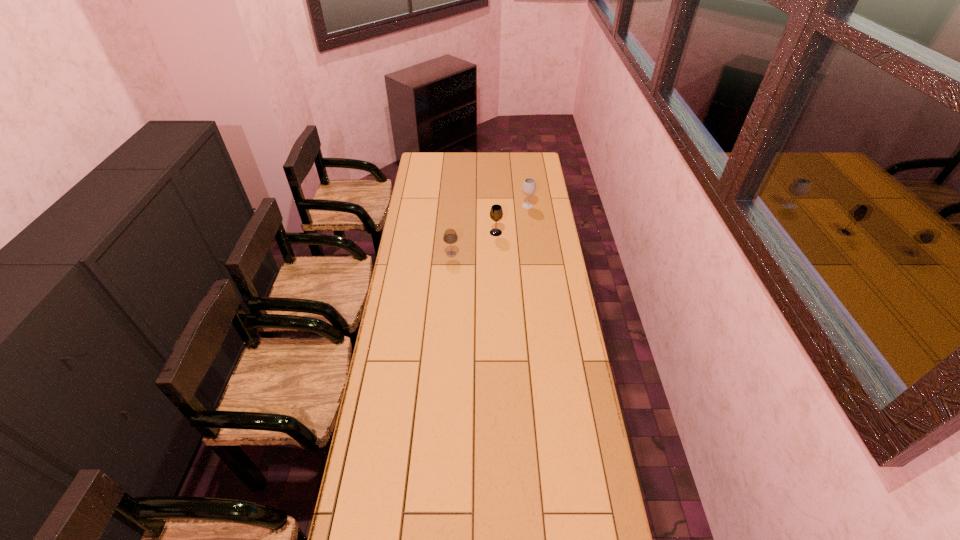
Image resolution: width=960 pixels, height=540 pixels. What are the coordinates of `vacant space at the far edge of the desktop` in the screenshot? It's located at (503, 161).

In the image, there is a desktop. Identify the location of vacant space at the left edge. (417, 179).

Identify the location of vacant space at the right edge. (558, 311).

This screenshot has height=540, width=960. What are the coordinates of `vacant space at the far left corner of the desktop` in the screenshot? It's located at tap(418, 161).

Find the location of a particular element. vacant region at the far right corner of the desktop is located at coordinates (536, 157).

At what (x,y) coordinates should I click in order to perform the action: click on vacant point located between the nearest wineglass and the second wineglass from right to left. Please return your answer as a coordinate pair (x, y). Looking at the image, I should click on (473, 243).

Identify the location of empty location between the leftmost object and the rightmost object. (490, 230).

At what (x,y) coordinates should I click in order to perform the action: click on vacant space in between the second wineglass from right to left and the nearest object. Please return your answer as a coordinate pair (x, y). The height and width of the screenshot is (540, 960). Looking at the image, I should click on (473, 243).

The width and height of the screenshot is (960, 540). What are the coordinates of `vacant area between the nearest object and the second farthest wineglass` in the screenshot? It's located at click(x=473, y=243).

I want to click on free spot between the farthest object and the second object from right to left, so click(512, 219).